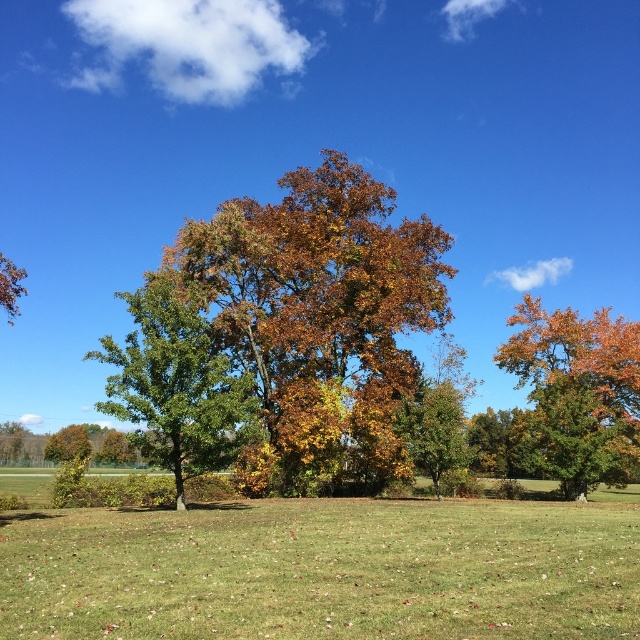
Question: Among these objects, which one is farthest from the camera?

Choices:
 (A) green leafy tree at left
 (B) golden-brown foliage at center
 (C) green grass at center

Answer: (B)

Question: Considering the real-world distances, which object is farthest from the golden-brown foliage at center?

Choices:
 (A) green leafy tree at left
 (B) green grass at center

Answer: (B)

Question: Can you confirm if green matte tree at lower left is smaller than green matte tree at upper left?

Choices:
 (A) no
 (B) yes

Answer: (A)

Question: Can you confirm if golden-brown foliage at center is bigger than green leafy tree at left?

Choices:
 (A) no
 (B) yes

Answer: (B)

Question: In this image, where is green leafy tree at left located relative to green matte tree at lower left?

Choices:
 (A) left
 (B) right

Answer: (B)

Question: Which point is farther to the camera?

Choices:
 (A) (337, 401)
 (B) (58, 440)

Answer: (B)